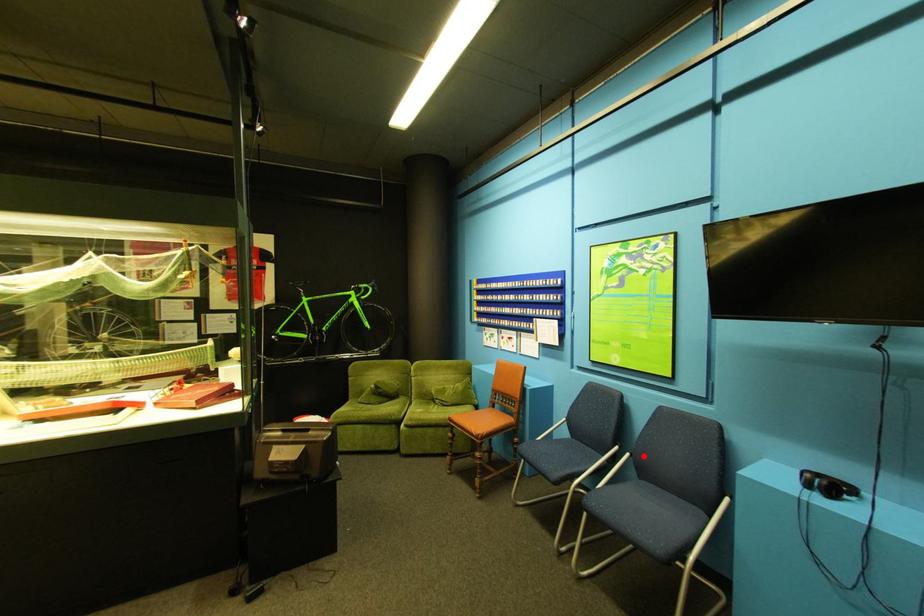
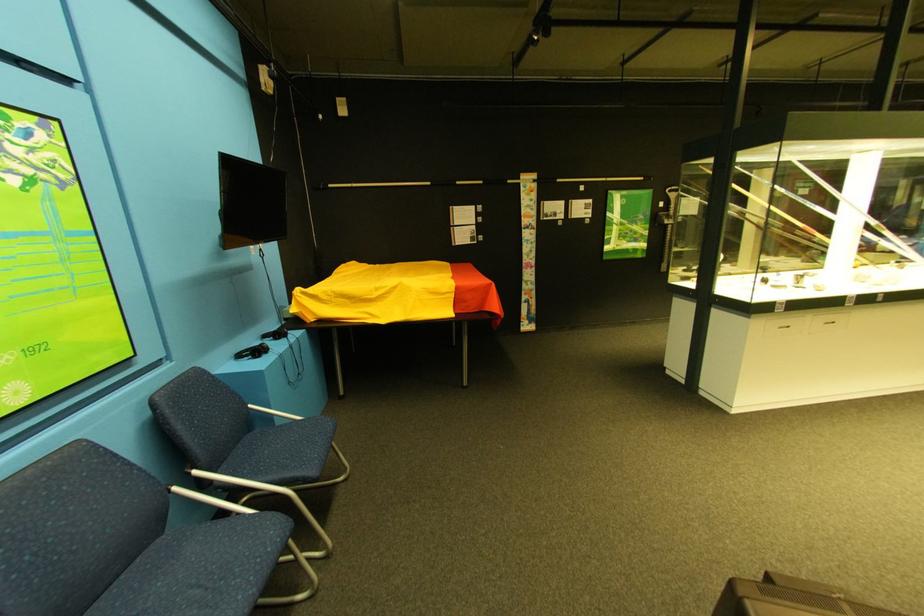
Where in the second image is the point corresponding to the highlighted location from the first image?

(210, 474)